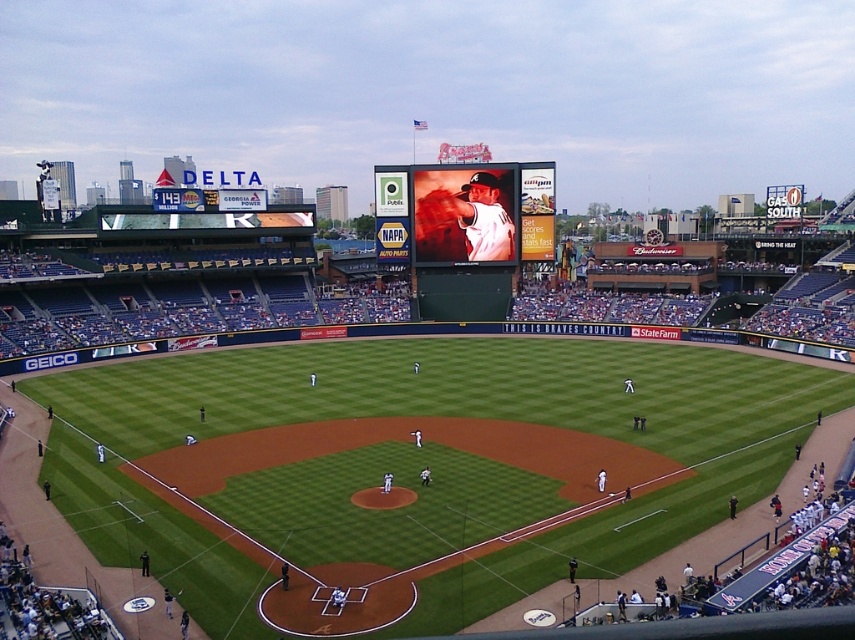
You are a drone operator trying to capture footage of the matte white baseball player at center and the matte black scoreboard at center. Your drone can only film objects within a 1.5 meter range. Can your drone capture both objects in a single shot?

The distance between the matte black scoreboard at center and the matte white baseball player at center is 1.22 meters, so yes, the drone can capture both objects in a single shot since they are within the 1.5 meter range.